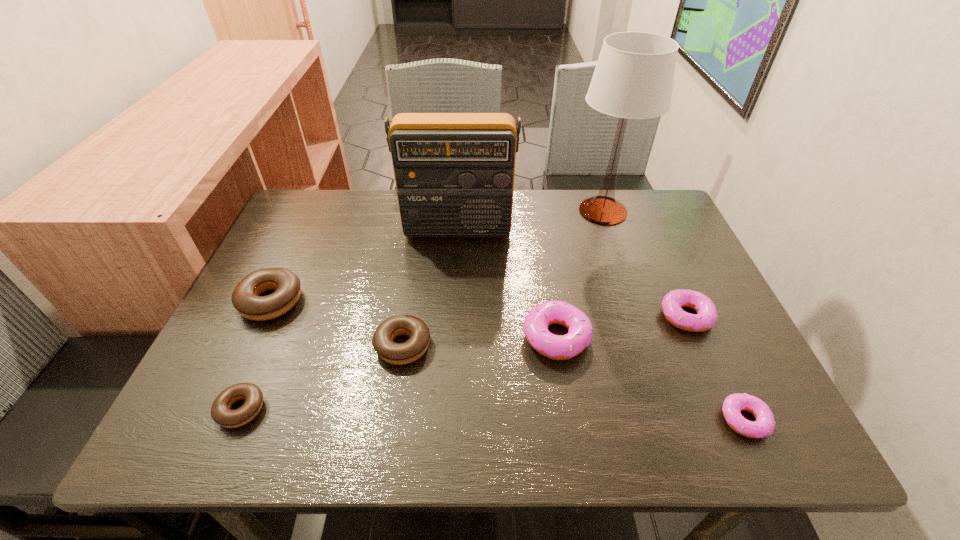
Locate an element on the screen. The image size is (960, 540). the tallest object is located at coordinates (633, 79).

Where is `radio receiver`? The width and height of the screenshot is (960, 540). radio receiver is located at coordinates (454, 172).

Locate an element on the screen. This screenshot has width=960, height=540. the biggest brown doughnut is located at coordinates (246, 299).

The image size is (960, 540). I want to click on the fourth doughnut from left to right, so click(x=557, y=347).

The width and height of the screenshot is (960, 540). Find the location of `the biggest pink doughnut`. the biggest pink doughnut is located at coordinates (557, 347).

You are a GUI agent. You are given a task and a screenshot of the screen. Output one action in this format:
    pyautogui.click(x=<x>, y=<y>)
    Task: Click on the second biggest brown doughnut
    Image resolution: width=960 pixels, height=540 pixels.
    Given the screenshot: What is the action you would take?
    pyautogui.click(x=394, y=353)

Where is `the rightmost brown doughnut`? Image resolution: width=960 pixels, height=540 pixels. the rightmost brown doughnut is located at coordinates (394, 353).

Image resolution: width=960 pixels, height=540 pixels. In order to click on the second smallest pink doughnut in this screenshot , I will do `click(706, 316)`.

Find the location of a particular element. This screenshot has width=960, height=540. the nearest brown doughnut is located at coordinates (221, 413).

Where is `the smallest pink doughnut`? Image resolution: width=960 pixels, height=540 pixels. the smallest pink doughnut is located at coordinates (764, 426).